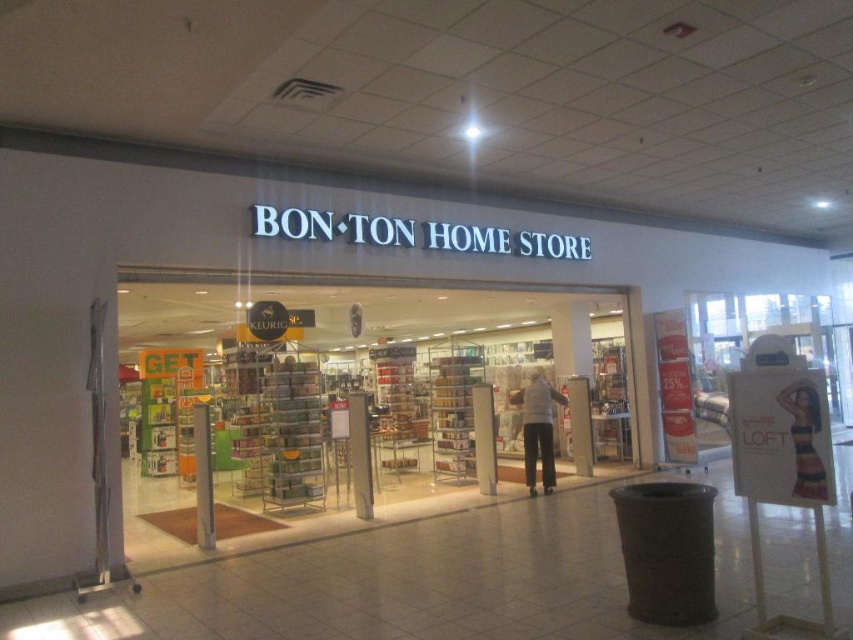
You are a delivery person who needs to unload a box that is 6.5 meters long into the BON TON HOME STORE. The clear plastic shelves at center are the only storage space available. Can the box fit between them?

The clear plastic shelves at center are 6.49 meters apart. The box is 6.5 meters long, which is slightly longer than the space between the shelves. Therefore, the box cannot fit between them.

You are a customer standing at the entrance of BON TON HOME STORE. You see the clear plastic shelves at center and the gray wool sweater at center. Which object is closer to you?

The clear plastic shelves at center is closer to you because it is in front of the gray wool sweater at center.

You are a delivery person who needs to place a large package on the clear plastic shelves at center. The package is as wide as the gray wool sweater at center. Can the package fit on the shelves?

The clear plastic shelves at center might be wider than gray wool sweater at center, so the package, which is as wide as the sweater, could potentially fit on the shelves.